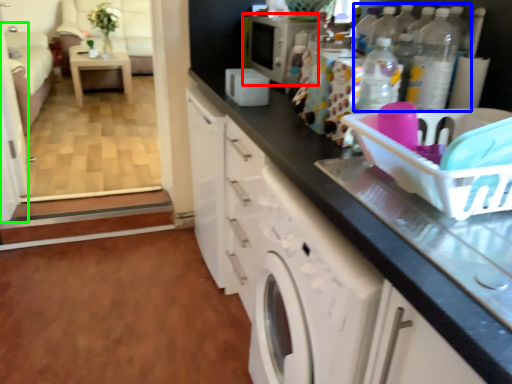
Question: Considering the real-world distances, which object is farthest from appliance (highlighted by a red box)? bottle (highlighted by a blue box) or screen door (highlighted by a green box)?

Choices:
 (A) bottle
 (B) screen door

Answer: (B)